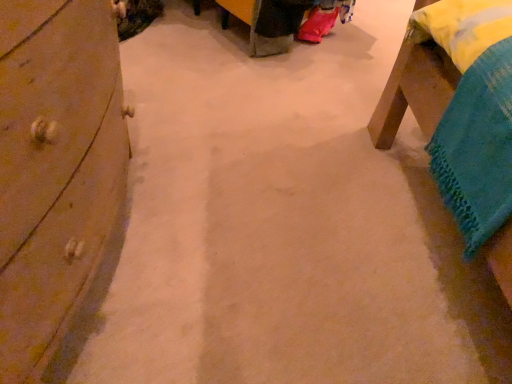
Question: Is point (67, 3) positioned closer to the camera than point (428, 99)?

Choices:
 (A) closer
 (B) farther

Answer: (A)

Question: Is wooden dresser at left taller or shorter than wooden bed frame at upper right?

Choices:
 (A) short
 (B) tall

Answer: (B)

Question: From a real-world perspective, is wooden dresser at left above or below wooden bed frame at upper right?

Choices:
 (A) above
 (B) below

Answer: (A)

Question: Is point (422, 105) closer or farther from the camera than point (53, 167)?

Choices:
 (A) farther
 (B) closer

Answer: (A)

Question: Do you think wooden bed frame at upper right is within wooden dresser at left, or outside of it?

Choices:
 (A) inside
 (B) outside

Answer: (B)

Question: From a real-world perspective, is wooden bed frame at upper right above or below wooden dresser at left?

Choices:
 (A) below
 (B) above

Answer: (A)

Question: Visually, is wooden bed frame at upper right positioned to the left or to the right of wooden dresser at left?

Choices:
 (A) left
 (B) right

Answer: (B)